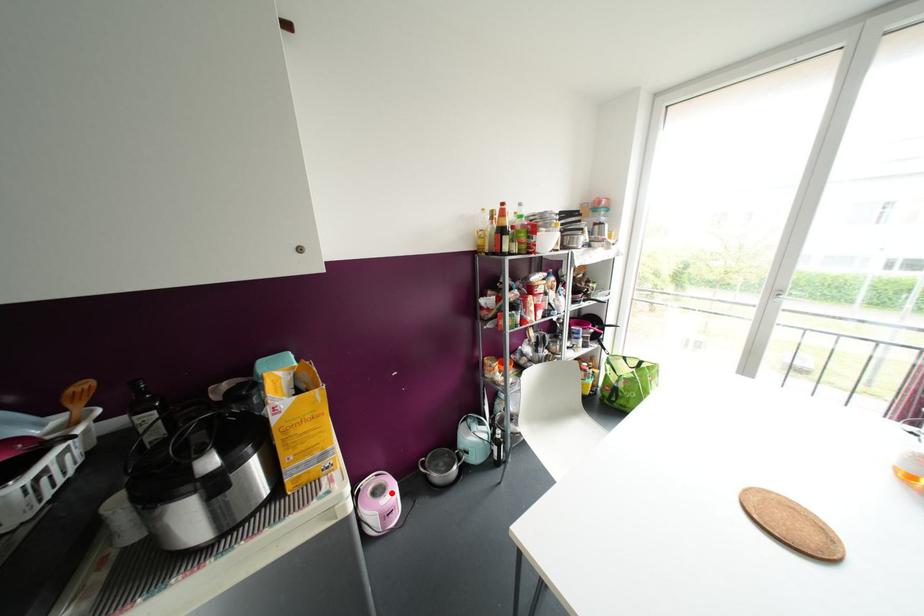
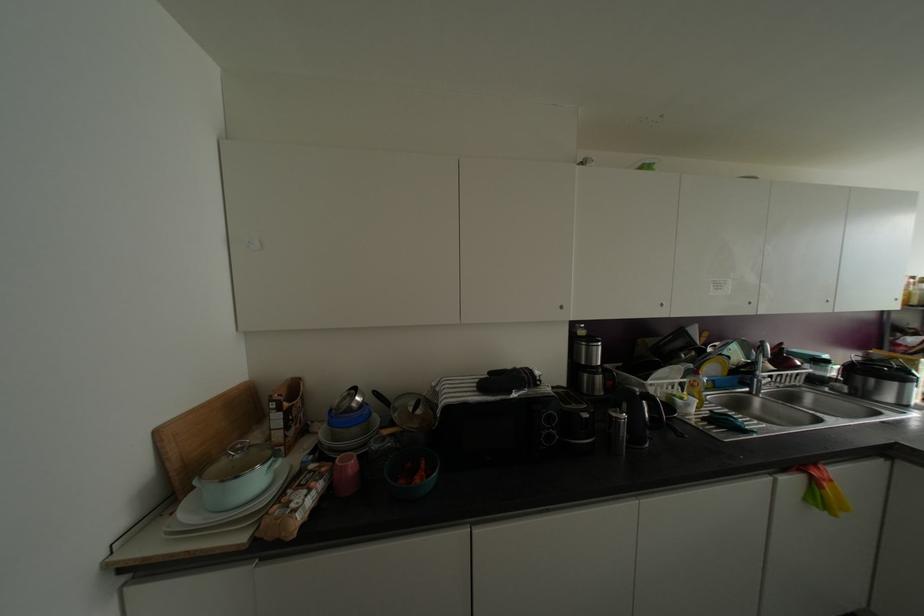
Question: I am providing you with two images of the same scene from different viewpoints. A red point is marked on the first image. Is the red point's position out of view in image 2?

Choices:
 (A) Yes
 (B) No

Answer: (A)